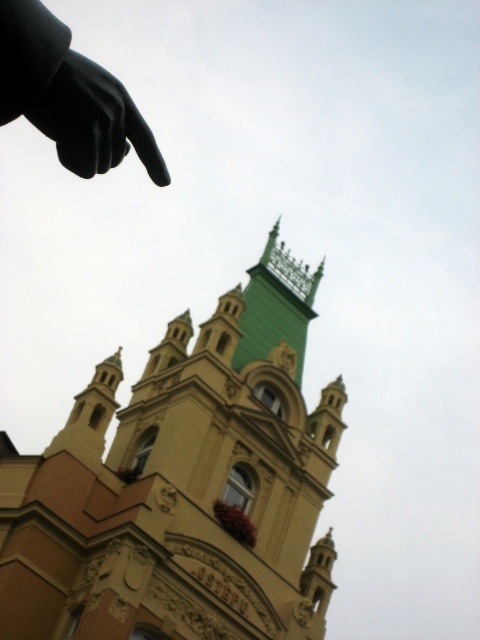
From the picture: You are standing in front of the beige stone church at center and want to touch the black matte hand at upper left. Which direction should you move to reach it?

The beige stone church at center is closer to you than the black matte hand at upper left, so you need to move forward towards the church and then look up to reach the black matte hand at upper left.

You are standing in front of a beige stone church at center and want to take a photo of it. If your camera has a maximum focus range of 60 meters, will you be able to capture the church clearly?

The beige stone church at center is 61.60 meters away from the camera, which exceeds the maximum focus range of 60 meters. Therefore, the camera cannot capture the church clearly at this distance.